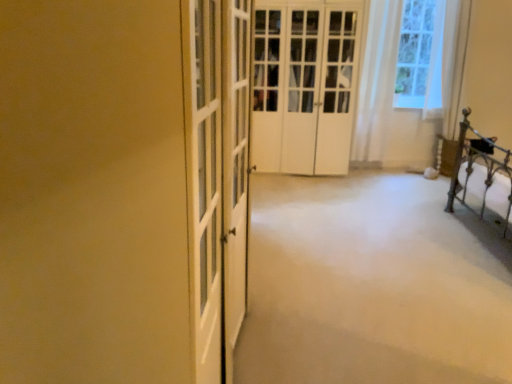
Question: Is white sheer curtain at upper right not inside white carpet at center?

Choices:
 (A) yes
 (B) no

Answer: (A)

Question: From the image's perspective, is white sheer curtain at upper right over white carpet at center?

Choices:
 (A) yes
 (B) no

Answer: (A)

Question: Is white sheer curtain at upper right turned away from white carpet at center?

Choices:
 (A) no
 (B) yes

Answer: (A)

Question: Does white sheer curtain at upper right have a greater width compared to white carpet at center?

Choices:
 (A) yes
 (B) no

Answer: (B)

Question: Can you confirm if white sheer curtain at upper right is smaller than white carpet at center?

Choices:
 (A) no
 (B) yes

Answer: (B)

Question: In the image, is white carpet at center on the left side or the right side of white matte door at center?

Choices:
 (A) left
 (B) right

Answer: (B)

Question: From a real-world perspective, relative to white matte door at center, is white carpet at center vertically above or below?

Choices:
 (A) above
 (B) below

Answer: (B)

Question: Is white carpet at center inside the boundaries of white matte door at center, or outside?

Choices:
 (A) inside
 (B) outside

Answer: (B)

Question: Relative to white matte door at center, is white carpet at center in front or behind?

Choices:
 (A) behind
 (B) front

Answer: (B)

Question: In terms of width, does white matte door at center look wider or thinner when compared to white carpet at center?

Choices:
 (A) thin
 (B) wide

Answer: (A)

Question: Is white matte door at center inside or outside of white carpet at center?

Choices:
 (A) inside
 (B) outside

Answer: (B)

Question: Considering the positions of point 334,87 and point 393,352, is point 334,87 closer or farther from the camera than point 393,352?

Choices:
 (A) farther
 (B) closer

Answer: (A)

Question: In terms of size, does white matte door at center appear bigger or smaller than white carpet at center?

Choices:
 (A) big
 (B) small

Answer: (A)

Question: Considering the positions of white sheer curtain at upper right and white matte door at center in the image, is white sheer curtain at upper right taller or shorter than white matte door at center?

Choices:
 (A) tall
 (B) short

Answer: (B)

Question: In the image, is white sheer curtain at upper right on the left side or the right side of white matte door at center?

Choices:
 (A) right
 (B) left

Answer: (A)